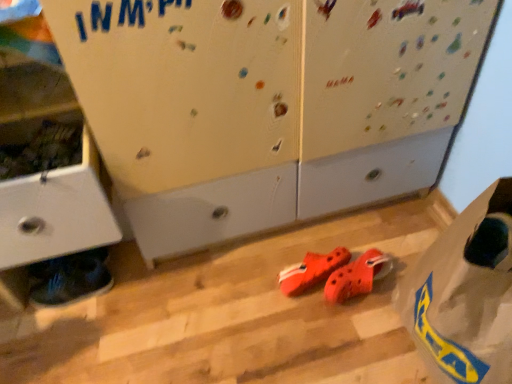
At what (x,y) coordinates should I click in order to perform the action: click on vacant space to the right of orange rubber clogs at center, the 3th footwear in the left-to-right sequence. Please return your answer as a coordinate pair (x, y). The image size is (512, 384). Looking at the image, I should click on (395, 268).